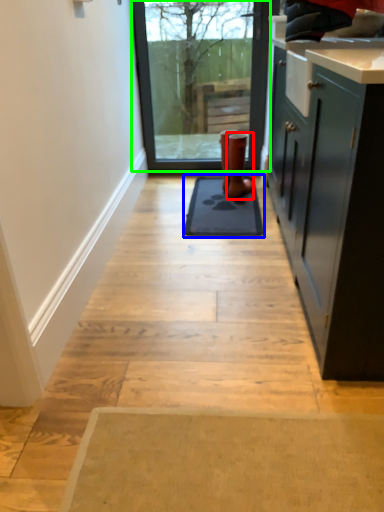
Question: Estimate the real-world distances between objects in this image. Which object is closer to footwear (highlighted by a red box), mat (highlighted by a blue box) or window (highlighted by a green box)?

Choices:
 (A) mat
 (B) window

Answer: (A)